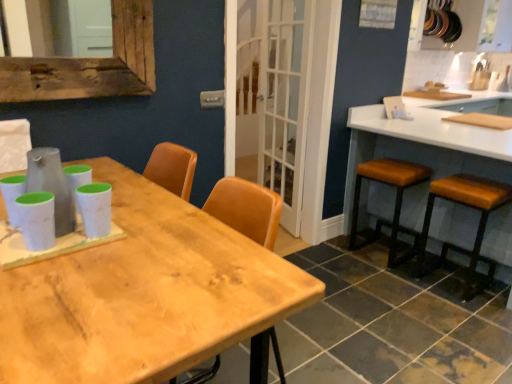
This screenshot has height=384, width=512. In order to click on free point above brown leather stool at right, positioned as the 1th stool in right-to-left order (from a real-world perspective) in this screenshot , I will do `click(464, 186)`.